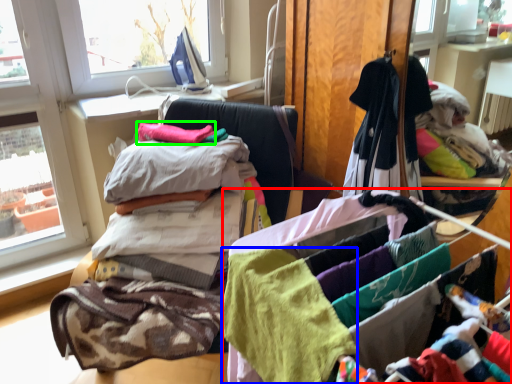
Question: Based on their relative distances, which object is farther from material (highlighted by a red box)? Choose from baby clothe (highlighted by a blue box) and baby clothe (highlighted by a green box).

Choices:
 (A) baby clothe
 (B) baby clothe

Answer: (B)